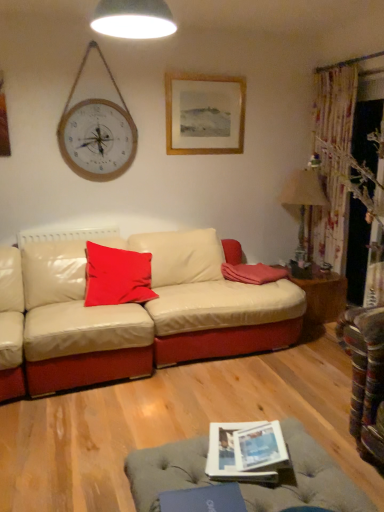
Question: In terms of width, does wooden framed picture at upper center look wider or thinner when compared to matte paper magazine at lower center?

Choices:
 (A) thin
 (B) wide

Answer: (A)

Question: Is point (180, 75) positioned closer to the camera than point (286, 455)?

Choices:
 (A) closer
 (B) farther

Answer: (B)

Question: Which is nearer to the white glossy lampshade at upper center, arranged as the 1th lamp when viewed from the top?

Choices:
 (A) wooden side table at right
 (B) soft pink fabric pillow at center, positioned as the first pillow in right-to-left order
 (C) wooden framed picture at upper center
 (D) matte red cushion at center, the 2th pillow from the right
 (E) matte paper magazine at lower center

Answer: (C)

Question: Which object is positioned closest to the wooden side table at right?

Choices:
 (A) wooden framed picture at upper center
 (B) soft pink fabric pillow at center, positioned as the first pillow in right-to-left order
 (C) matte paper magazine at lower center
 (D) matte red cushion at center, which is counted as the 1th pillow, starting from the left
 (E) white glossy lampshade at upper center, which is counted as the 2th lamp, starting from the back

Answer: (B)